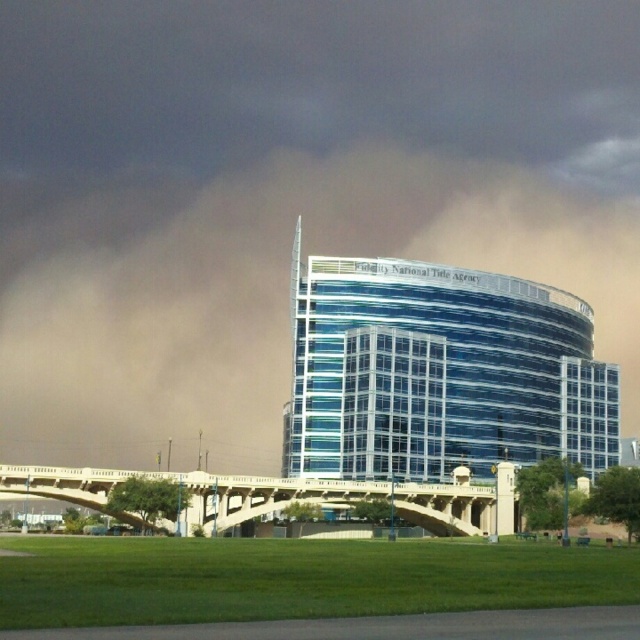
You are a drone operator planning to fly a drone over the scene. You need to avoid obstacles. Based on the image, is the brown dusty cloud at upper center positioned above the blue glass building at center or below it?

The brown dusty cloud at upper center is located above the blue glass building at center.

You are a visitor trying to locate the Fidelity National Title Agency. From your current position, you see the blue glass building at center and the beige concrete bridge at center. Which direction should you move to reach the agency?

The blue glass building at center is to the right of the beige concrete bridge at center, so you should move to the right to reach the Fidelity National Title Agency.